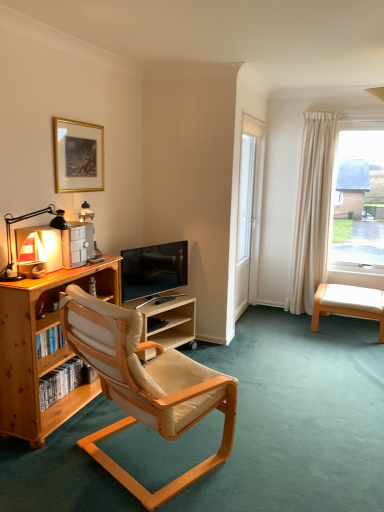
Identify the location of free location to the right of beige leather chair at center. (285, 454).